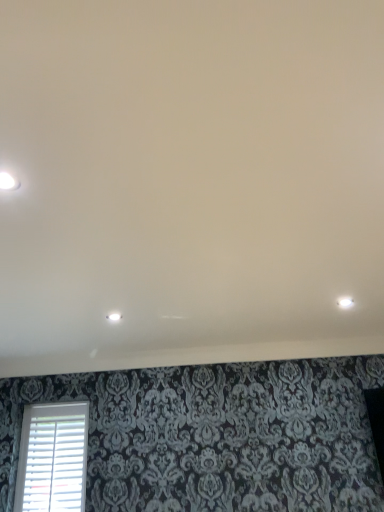
Question: Is white plastic blinds at lower left wider than white glossy light fixture at upper left, positioned as the 2th dot in back-to-front order?

Choices:
 (A) yes
 (B) no

Answer: (B)

Question: Is white plastic blinds at lower left far away from white glossy light fixture at upper left, positioned as the 2th dot in back-to-front order?

Choices:
 (A) yes
 (B) no

Answer: (A)

Question: Is white plastic blinds at lower left positioned beyond the bounds of white glossy light fixture at upper left, acting as the second dot starting from the right?

Choices:
 (A) yes
 (B) no

Answer: (A)

Question: Can you confirm if white plastic blinds at lower left is positioned to the right of white glossy light fixture at upper left, the 2th dot from the bottom?

Choices:
 (A) no
 (B) yes

Answer: (A)

Question: Could white glossy light fixture at upper left, placed as the first dot when sorted from top to bottom, be considered to be inside white plastic blinds at lower left?

Choices:
 (A) no
 (B) yes

Answer: (A)

Question: Is white plastic blinds at lower left positioned in front of white glossy light fixture at upper left, positioned as the 2th dot in back-to-front order?

Choices:
 (A) yes
 (B) no

Answer: (B)

Question: Is there a large distance between white glossy light fixture at center, the 2th dot when ordered from top to bottom, and white glossy light fixture at upper left, placed as the first dot when sorted from top to bottom?

Choices:
 (A) no
 (B) yes

Answer: (B)

Question: Considering the relative positions of white glossy light fixture at center, the 2th dot when ordered from top to bottom, and white glossy light fixture at upper left, positioned as the 2th dot in back-to-front order, in the image provided, is white glossy light fixture at center, the 2th dot when ordered from top to bottom, in front of white glossy light fixture at upper left, positioned as the 2th dot in back-to-front order,?

Choices:
 (A) no
 (B) yes

Answer: (A)

Question: Can white glossy light fixture at upper left, acting as the second dot starting from the right, be found inside white glossy light fixture at center, placed as the first dot when sorted from right to left?

Choices:
 (A) yes
 (B) no

Answer: (B)

Question: Is white glossy light fixture at center, the 2th dot when ordered from top to bottom, outside white glossy light fixture at upper left, placed as the first dot when sorted from top to bottom?

Choices:
 (A) yes
 (B) no

Answer: (A)

Question: From the image's perspective, is white glossy light fixture at center, placed as the first dot when sorted from right to left, located above white glossy light fixture at upper left, acting as the second dot starting from the right?

Choices:
 (A) no
 (B) yes

Answer: (A)

Question: Is white glossy light fixture at center, placed as the second dot when sorted from left to right, smaller than white glossy light fixture at upper left, which ranks as the 1th dot in front-to-back order?

Choices:
 (A) yes
 (B) no

Answer: (B)

Question: Does white plastic blinds at lower left have a greater width compared to white glossy light fixture at center, placed as the second dot when sorted from left to right?

Choices:
 (A) no
 (B) yes

Answer: (A)